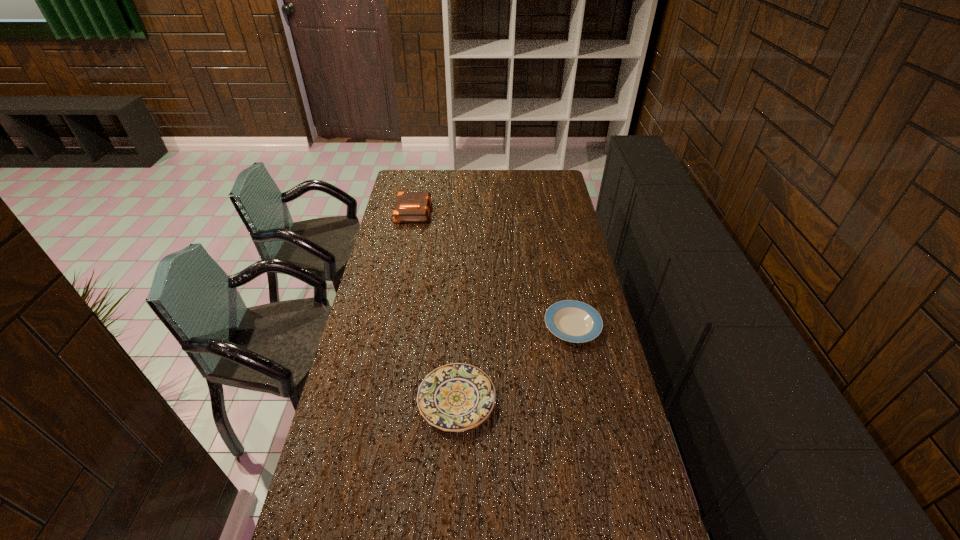
Identify which object is located as the second nearest to the leftmost object. Please provide its 2D coordinates. Your answer should be formatted as a tuple, i.e. [(x, y)], where the tuple contains the x and y coordinates of a point satisfying the conditions above.

[(456, 397)]

I want to click on object that ranks as the closest to the farther plate, so click(x=456, y=397).

Find the location of a particular element. free space that satisfies the following two spatial constraints: 1. on the spine side of the nearest object; 2. on the right side of the tallest object is located at coordinates (376, 400).

This screenshot has height=540, width=960. I want to click on vacant space that satisfies the following two spatial constraints: 1. on the spine side of the leftmost object; 2. on the left side of the second object from left to right, so click(x=376, y=400).

At what (x,y) coordinates should I click in order to perform the action: click on free space that satisfies the following two spatial constraints: 1. on the spine side of the rightmost object; 2. on the right side of the farthest object. Please return your answer as a coordinate pair (x, y). This screenshot has height=540, width=960. Looking at the image, I should click on (391, 325).

This screenshot has width=960, height=540. What are the coordinates of `free spot that satisfies the following two spatial constraints: 1. on the spine side of the left plate; 2. on the right side of the Bible` in the screenshot? It's located at (376, 400).

I want to click on vacant space that satisfies the following two spatial constraints: 1. on the spine side of the right plate; 2. on the left side of the Bible, so click(391, 325).

The image size is (960, 540). In order to click on free space that satisfies the following two spatial constraints: 1. on the spine side of the second object from left to right; 2. on the left side of the tallest object in this screenshot , I will do `click(376, 400)`.

Locate an element on the screen. The image size is (960, 540). free location that satisfies the following two spatial constraints: 1. on the spine side of the Bible; 2. on the back side of the second object from right to left is located at coordinates (376, 400).